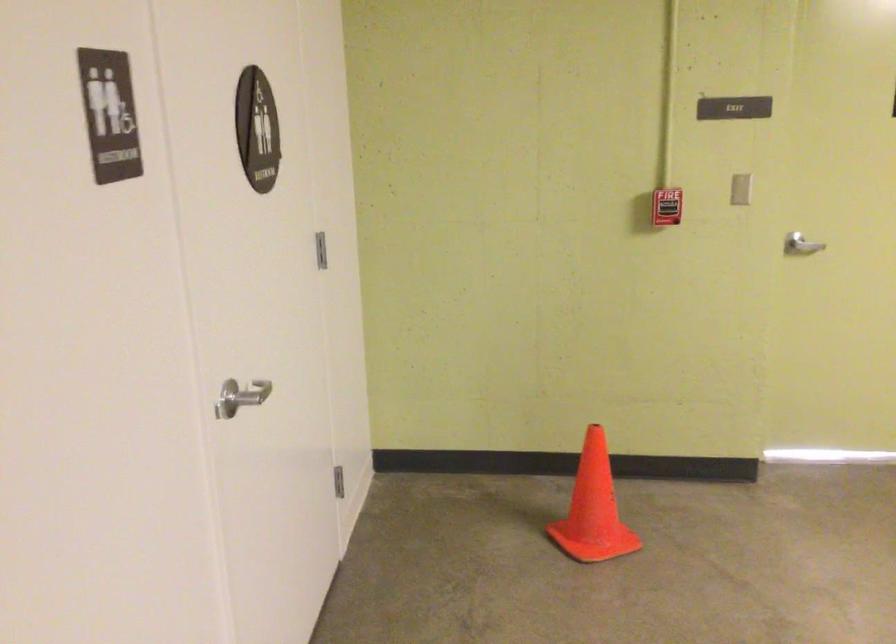
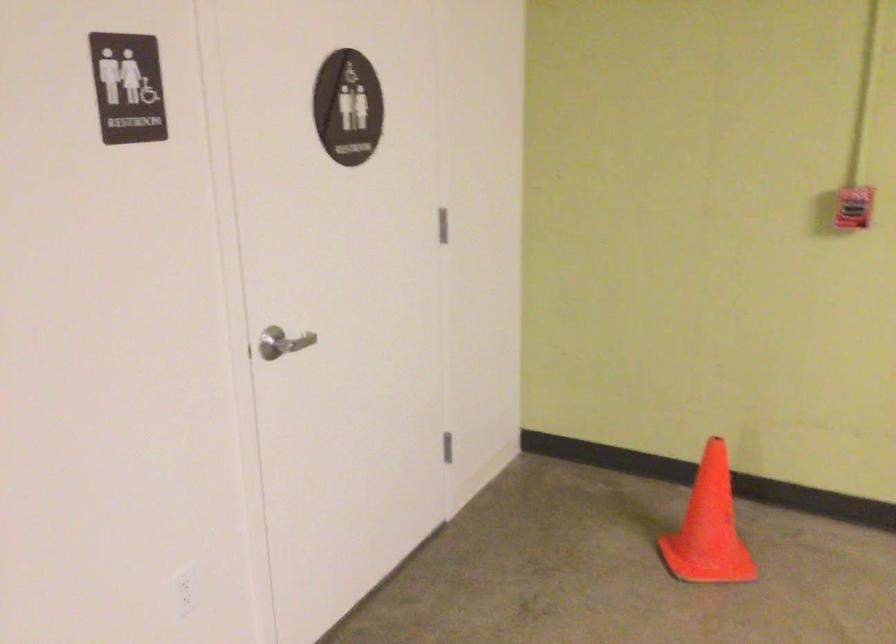
The point at (244, 395) is marked in the first image. Where is the corresponding point in the second image?

(281, 343)